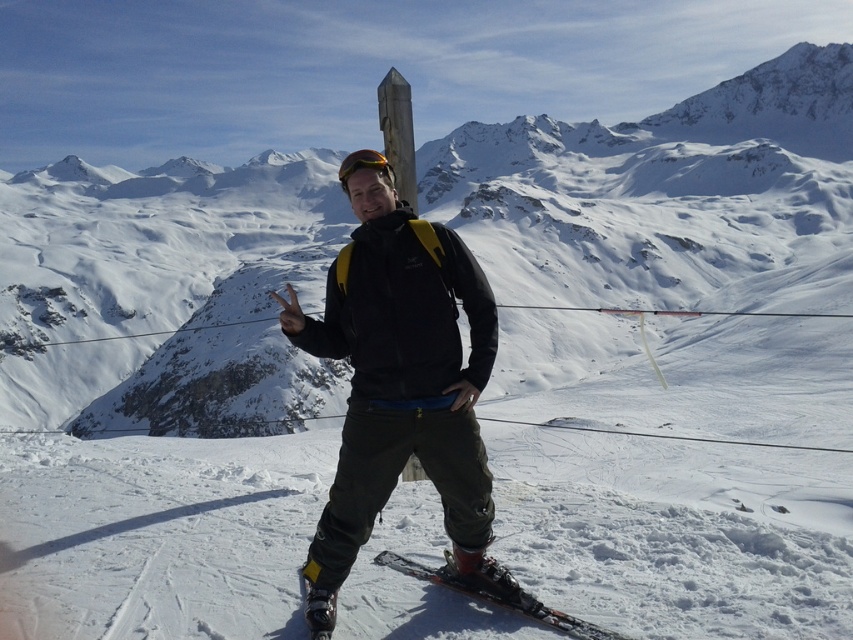
Question: Does snowy mountain at center appear over black matte jacket at center?

Choices:
 (A) no
 (B) yes

Answer: (B)

Question: Which is nearer to the black matte jacket at center?

Choices:
 (A) shiny black ski at lower center
 (B) snowy mountain at center

Answer: (A)

Question: Which is nearer to the black matte jacket at center?

Choices:
 (A) shiny black ski at lower center
 (B) snowy mountain at center

Answer: (A)

Question: Does snowy mountain at center appear over black matte jacket at center?

Choices:
 (A) no
 (B) yes

Answer: (B)

Question: Which point is closer to the camera?

Choices:
 (A) shiny black ski at lower center
 (B) black matte jacket at center

Answer: (A)

Question: Where is snowy mountain at center located in relation to black matte jacket at center in the image?

Choices:
 (A) left
 (B) right

Answer: (A)